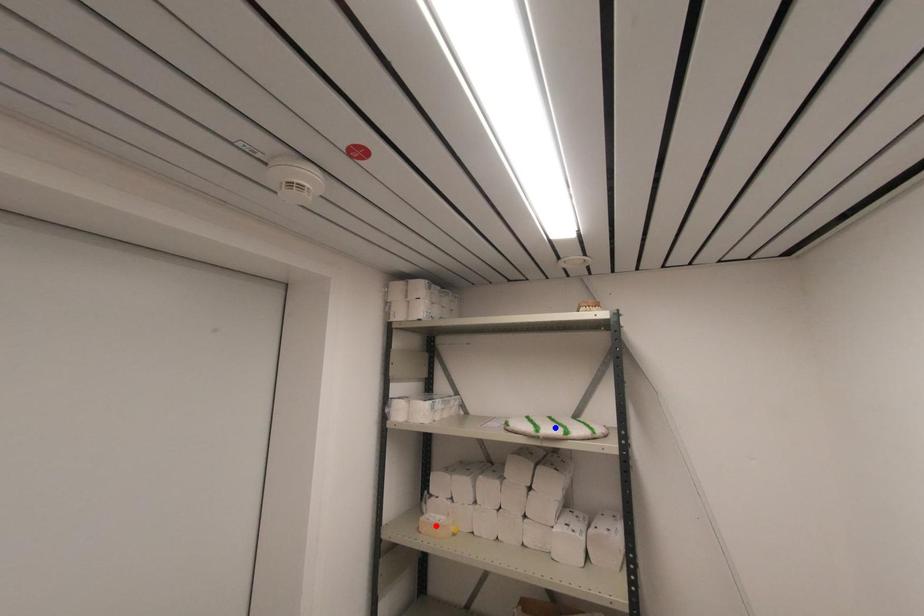
Question: Two points are marked on the image. Which point is closer to the camera?

Choices:
 (A) Blue point is closer.
 (B) Red point is closer.

Answer: (A)